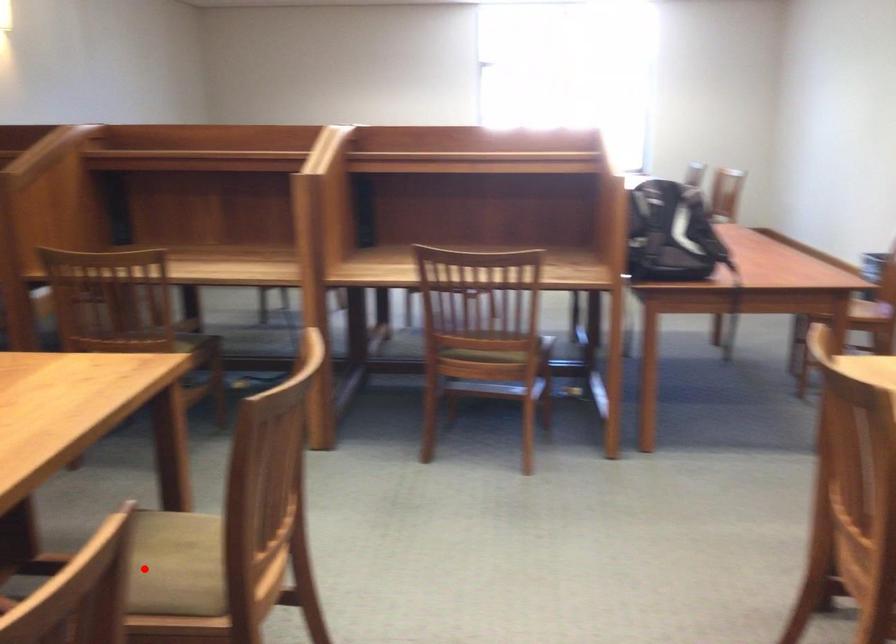
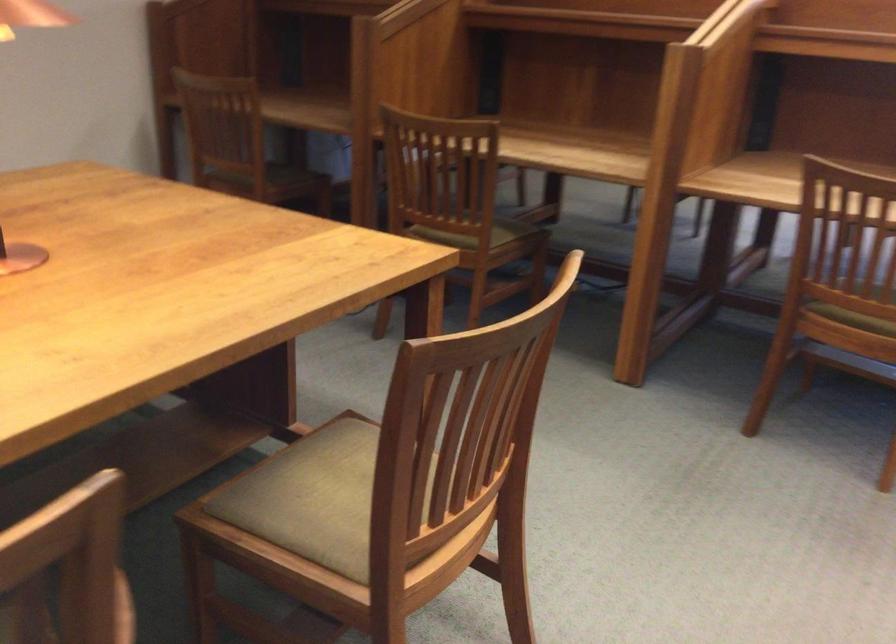
Question: A red point is marked in image1. In image2, is the corresponding 3D point closer to the camera or farther? Reply with the corresponding letter.

Choices:
 (A) The corresponding 3D point is closer.
 (B) The corresponding 3D point is farther.

Answer: (A)